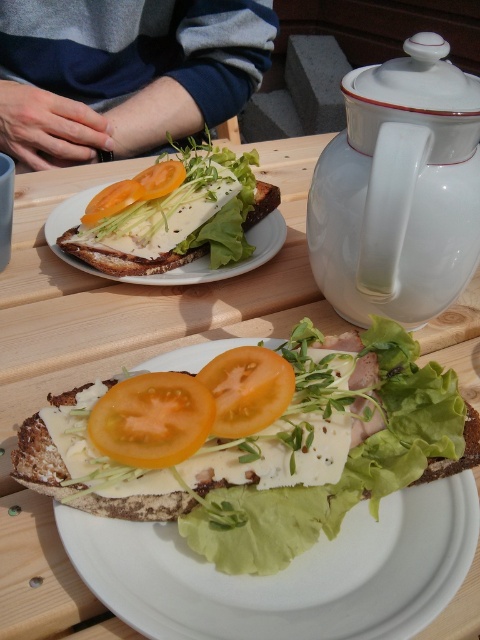
Which is in front, point (361, 625) or point (274, 412)?

Positioned in front is point (361, 625).

From the picture: Does white cheese sandwich at center appear under yellow juicy tomato at center?

Correct, white cheese sandwich at center is located below yellow juicy tomato at center.

Is point (335, 605) positioned before point (267, 364)?

Yes.

Find the location of a particular element. white cheese sandwich at center is located at coordinates (288, 572).

Looking at this image, does yellow juicy tomato at center have a greater width compared to orange matte tomato at upper center?

No, yellow juicy tomato at center is not wider than orange matte tomato at upper center.

Does yellow juicy tomato at center have a smaller size compared to orange matte tomato at upper center?

Indeed, yellow juicy tomato at center has a smaller size compared to orange matte tomato at upper center.

Measure the distance between point (231,353) and camera.

They are 35.86 centimeters apart.

Find the location of a particular element. The width and height of the screenshot is (480, 640). yellow juicy tomato at center is located at coordinates [247, 388].

Is point (115, 410) positioned before point (290, 372)?

Yes, point (115, 410) is closer to viewer.

In the scene shown: Can you confirm if juicy orange tomato at center is thinner than yellow juicy tomato at center?

In fact, juicy orange tomato at center might be wider than yellow juicy tomato at center.

Who is more distant from viewer, (128, 397) or (262, 406)?

Point (128, 397)

This screenshot has height=640, width=480. I want to click on juicy orange tomato at center, so click(x=153, y=419).